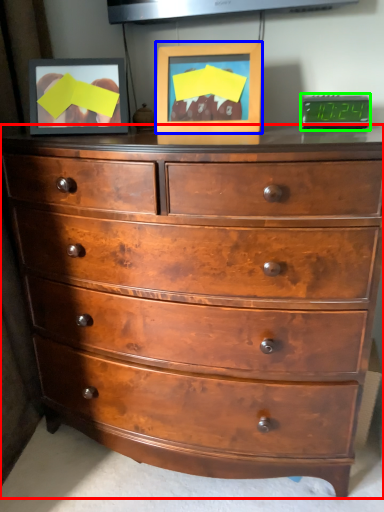
Question: Which object is positioned closest to chest of drawers (highlighted by a red box)? Select from picture frame (highlighted by a blue box) and alarm clock (highlighted by a green box).

Choices:
 (A) picture frame
 (B) alarm clock

Answer: (A)